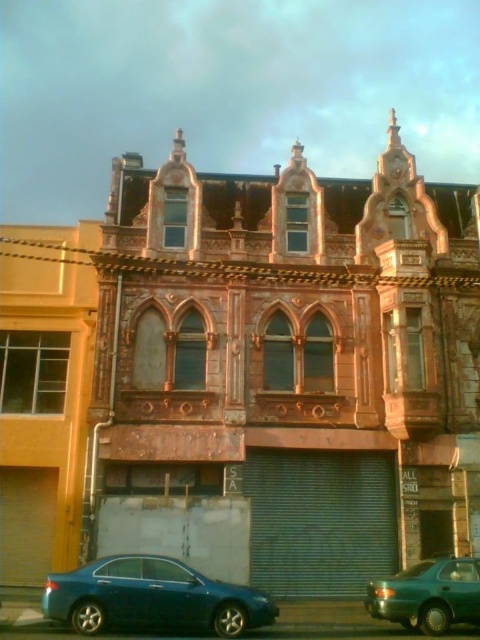
Can you confirm if matte blue sedan at lower left is bigger than teal glossy sedan at lower right?

Yes, matte blue sedan at lower left is bigger than teal glossy sedan at lower right.

Does point (146, 563) come farther from viewer compared to point (455, 589)?

No, (146, 563) is in front of (455, 589).

Where is `matte blue sedan at lower left`? The image size is (480, 640). matte blue sedan at lower left is located at coordinates (152, 596).